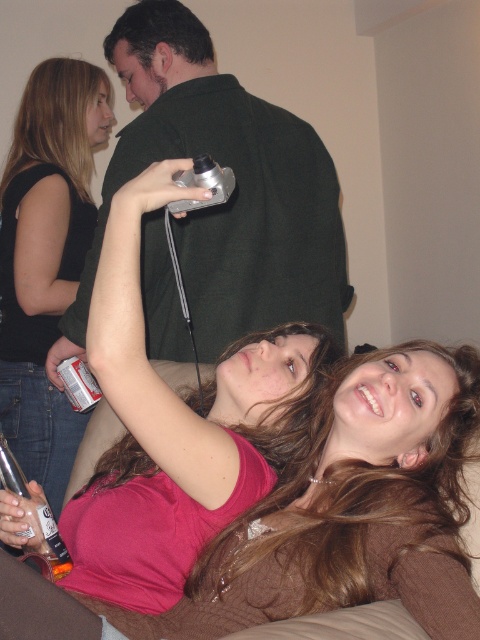
Question: Estimate the real-world distances between objects in this image. Which object is farther from the silver metallic game controller at upper center?

Choices:
 (A) matte black camera at upper left
 (B) pink matte shirt at center
 (C) translucent plastic bottle at lower left

Answer: (A)

Question: Is translucent plastic bottle at lower left behind silver metallic game controller at upper center?

Choices:
 (A) yes
 (B) no

Answer: (A)

Question: Is green matte shirt at upper center wider than matte silver camera at upper center?

Choices:
 (A) no
 (B) yes

Answer: (B)

Question: Does green matte shirt at upper center have a lesser width compared to matte black camera at upper left?

Choices:
 (A) yes
 (B) no

Answer: (B)

Question: Which of the following is the farthest from the observer?

Choices:
 (A) (60, 552)
 (B) (216, 525)
 (C) (180, 104)

Answer: (C)

Question: Which point appears closest to the camera in this image?

Choices:
 (A) (24, 506)
 (B) (36, 138)
 (C) (173, 136)
 (D) (181, 172)

Answer: (D)